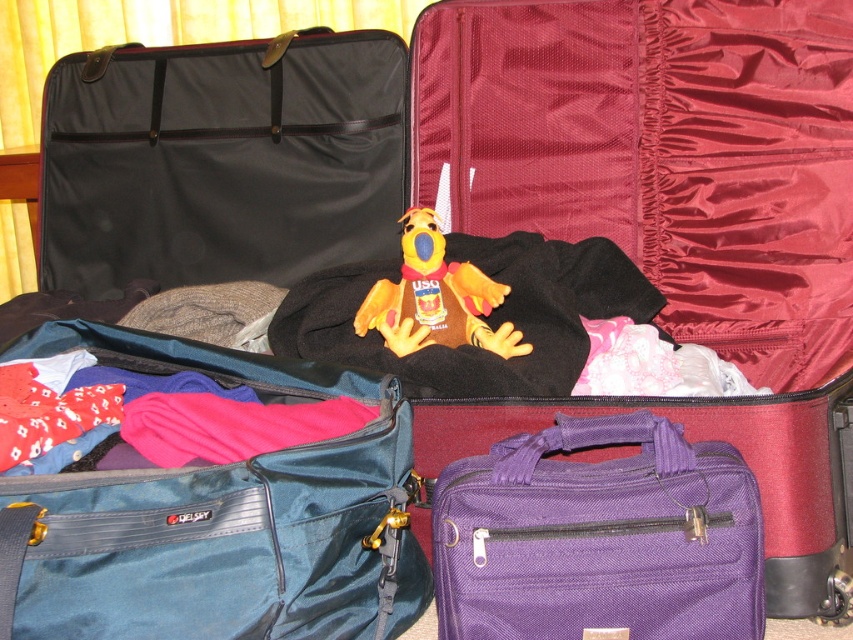
Between teal fabric bag at lower left and purple fabric briefcase at lower right, which one appears on the left side from the viewer's perspective?

From the viewer's perspective, teal fabric bag at lower left appears more on the left side.

Does teal fabric bag at lower left appear on the left side of purple fabric briefcase at lower right?

Indeed, teal fabric bag at lower left is positioned on the left side of purple fabric briefcase at lower right.

Where is `teal fabric bag at lower left`? The width and height of the screenshot is (853, 640). teal fabric bag at lower left is located at coordinates (218, 518).

Which is more to the left, teal fabric bag at lower left or yellow plush toy at center?

teal fabric bag at lower left

Where is `teal fabric bag at lower left`? Image resolution: width=853 pixels, height=640 pixels. teal fabric bag at lower left is located at coordinates (218, 518).

Looking at this image, which of these two, purple fabric briefcase at lower right or yellow plush toy at center, stands shorter?

Standing shorter between the two is yellow plush toy at center.

Is purple fabric briefcase at lower right above yellow plush toy at center?

Actually, purple fabric briefcase at lower right is below yellow plush toy at center.

This screenshot has width=853, height=640. Identify the location of purple fabric briefcase at lower right. (598, 536).

Identify the location of purple fabric briefcase at lower right. (598, 536).